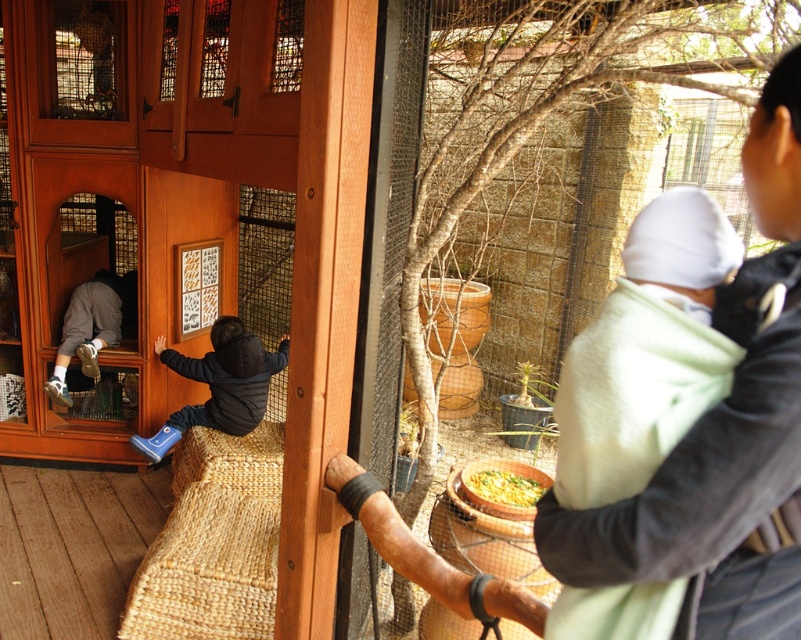
Question: Does matte wood screen door at left have a smaller size compared to matte gray hoodie at left?

Choices:
 (A) no
 (B) yes

Answer: (A)

Question: Which object is closer to the camera taking this photo?

Choices:
 (A) matte gray hoodie at left
 (B) matte wood screen door at left

Answer: (B)

Question: Which point appears closest to the camera in this image?

Choices:
 (A) (x=469, y=488)
 (B) (x=101, y=304)
 (C) (x=73, y=211)
 (D) (x=260, y=356)

Answer: (A)

Question: Is the position of matte wood screen door at left less distant than that of yellow matte bowl at lower center?

Choices:
 (A) yes
 (B) no

Answer: (B)

Question: Estimate the real-world distances between objects in this image. Which object is closer to the matte wood screen door at left?

Choices:
 (A) yellow matte bowl at lower center
 (B) blue rubber boots at left
 (C) matte gray hoodie at left

Answer: (C)

Question: Does blue rubber boots at left appear under matte gray hoodie at left?

Choices:
 (A) yes
 (B) no

Answer: (A)